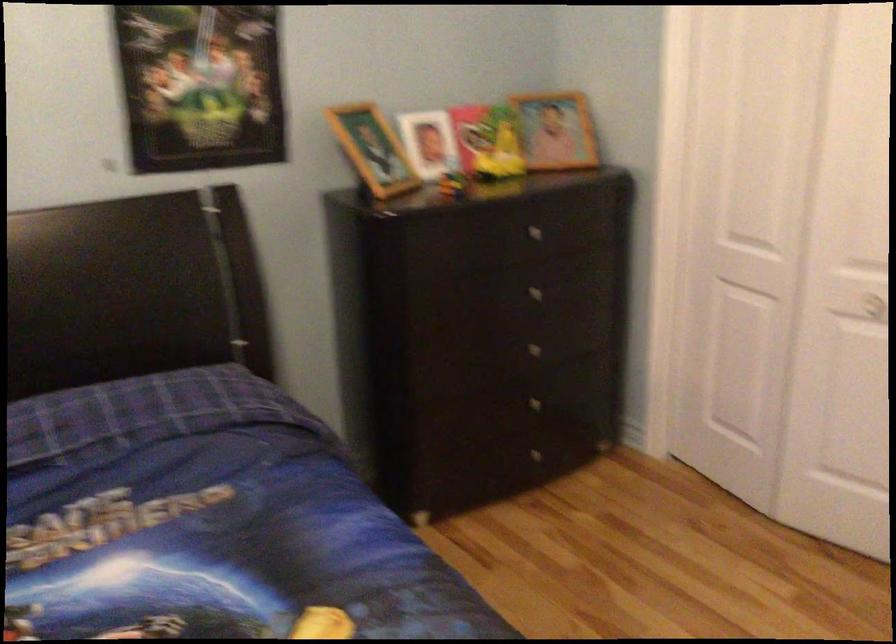
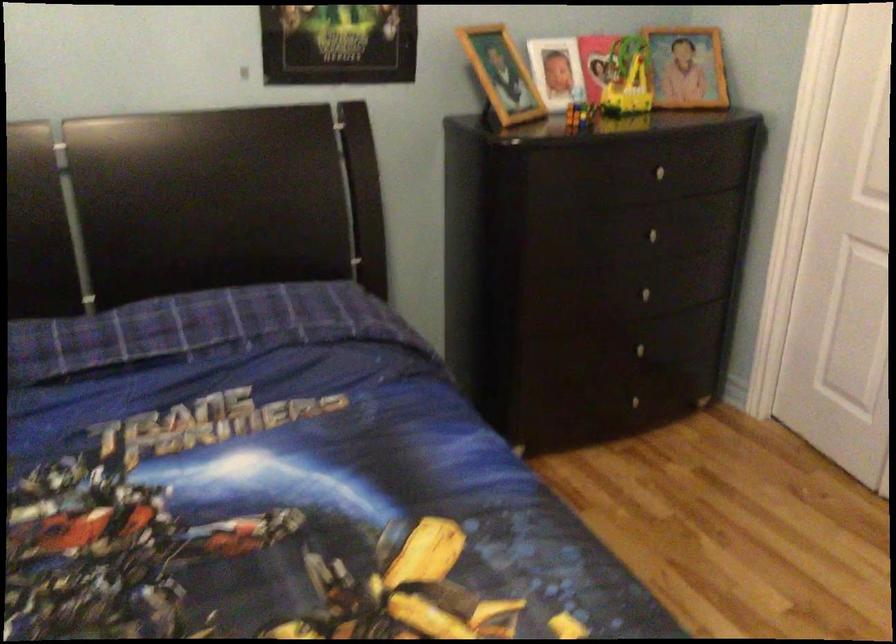
Question: The images are taken continuously from a first-person perspective. In which direction are you moving?

Choices:
 (A) Left
 (B) Right
 (C) Forward
 (D) Backward

Answer: (A)